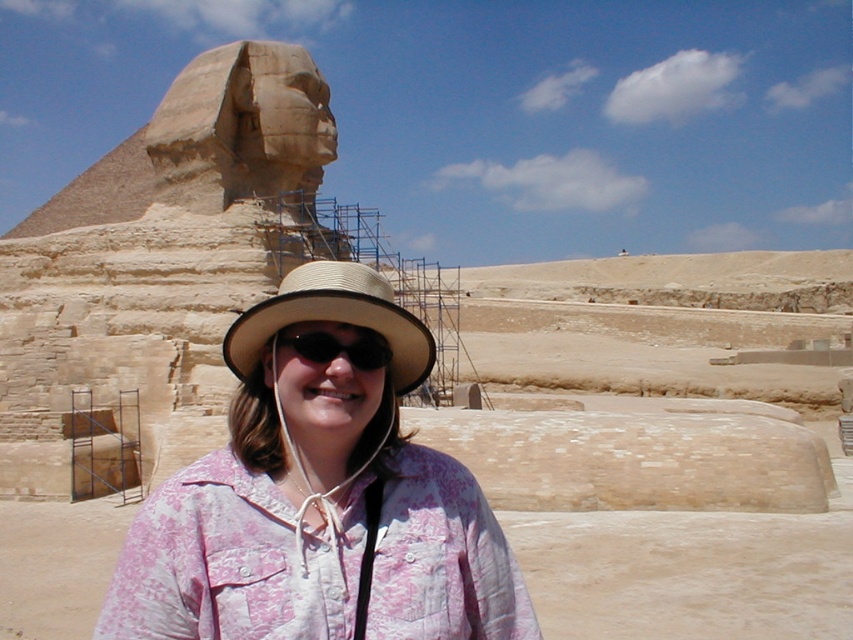
Question: Which point is farther from the camera taking this photo?

Choices:
 (A) (405, 371)
 (B) (323, 364)

Answer: (A)

Question: Can you confirm if beige stone sphinx at upper left is positioned above straw hat at center?

Choices:
 (A) yes
 (B) no

Answer: (A)

Question: Which of the following is the farthest from the observer?

Choices:
 (A) black plastic goggles at center
 (B) straw hat at center

Answer: (A)

Question: Is pink floral shirt at center wider than black plastic goggles at center?

Choices:
 (A) yes
 (B) no

Answer: (A)

Question: Where is beige stone sphinx at upper left located in relation to black plastic goggles at center in the image?

Choices:
 (A) left
 (B) right

Answer: (A)

Question: Among these points, which one is farthest from the camera?

Choices:
 (A) (357, 349)
 (B) (442, 598)

Answer: (A)